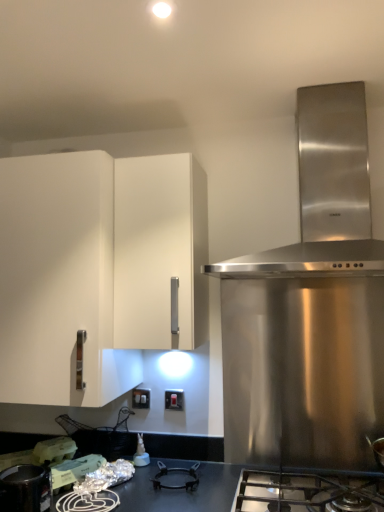
This screenshot has width=384, height=512. Find the location of `white matte cabinet at left`. white matte cabinet at left is located at coordinates (59, 281).

What do you see at coordinates (59, 281) in the screenshot? I see `white matte cabinet at left` at bounding box center [59, 281].

Locate an element on the screen. white plastic electric outlet at lower center, which ranks as the 1th electric outlet in left-to-right order is located at coordinates (141, 398).

Measure the distance between point (51, 439) and camera.

A distance of 1.83 meters exists between point (51, 439) and camera.

This screenshot has width=384, height=512. What are the coordinates of `shiny metallic pot at lower left` in the screenshot? It's located at (25, 489).

In order to face shiny metallic pot at lower left, should I rotate leftwards or rightwards?

Rotate left and turn 22.099 degrees.

Locate an element on the screen. This screenshot has height=512, width=384. stainless steel range hood at upper right is located at coordinates (325, 189).

Which of these two, stainless steel range hood at upper right or white plastic switch at lower center, the 1th electric outlet when ordered from right to left, is smaller?

white plastic switch at lower center, the 1th electric outlet when ordered from right to left.

Which object is positioned more to the right, stainless steel range hood at upper right or white plastic switch at lower center, the 1th electric outlet when ordered from right to left?

stainless steel range hood at upper right is more to the right.

How different are the orientations of stainless steel range hood at upper right and white plastic switch at lower center, the 1th electric outlet when ordered from right to left, in degrees?

There is a 0.278-degree angle between the facing directions of stainless steel range hood at upper right and white plastic switch at lower center, the 1th electric outlet when ordered from right to left.

From a real-world perspective, is stainless steel range hood at upper right above or below white plastic switch at lower center, the 1th electric outlet when ordered from right to left?

In terms of real-world spatial position, stainless steel range hood at upper right is above white plastic switch at lower center, the 1th electric outlet when ordered from right to left.

What's the angular difference between white matte plastic container at lower left and stainless steel range hood at upper right's facing directions?

They differ by 44.7 degrees in their facing directions.

Is point (53, 455) closer to camera compared to point (322, 179)?

That is False.

Is white matte plastic container at lower left not inside stainless steel range hood at upper right?

Yes, white matte plastic container at lower left is outside of stainless steel range hood at upper right.

Considering the sizes of objects stainless steel gas stove at lower center and white plastic switch at lower center, the 1th electric outlet when ordered from right to left, in the image provided, who is bigger, stainless steel gas stove at lower center or white plastic switch at lower center, the 1th electric outlet when ordered from right to left,?

Bigger between the two is stainless steel gas stove at lower center.

Between stainless steel gas stove at lower center and white plastic switch at lower center, the second electric outlet in the left-to-right sequence, which one is positioned behind?

Positioned behind is white plastic switch at lower center, the second electric outlet in the left-to-right sequence.

Is stainless steel gas stove at lower center spatially inside white plastic switch at lower center, the 1th electric outlet when ordered from right to left, or outside of it?

stainless steel gas stove at lower center lies outside white plastic switch at lower center, the 1th electric outlet when ordered from right to left.

From a real-world perspective, does stainless steel gas stove at lower center sit lower than white plastic switch at lower center, the second electric outlet in the left-to-right sequence?

Yes, from a real-world perspective, stainless steel gas stove at lower center is beneath white plastic switch at lower center, the second electric outlet in the left-to-right sequence.

From a real-world perspective, who is located lower, white plastic electric outlet at lower center, the 2th electric outlet from the right, or stainless steel gas stove at lower center?

In real-world perspective, stainless steel gas stove at lower center is lower.

Could you measure the distance between white plastic electric outlet at lower center, the 2th electric outlet from the right, and stainless steel gas stove at lower center?

29.00 inches.

Between point (137, 400) and point (383, 490), which one is positioned behind?

The point (137, 400) is farther.

Between white plastic electric outlet at lower center, the 2th electric outlet from the right, and stainless steel gas stove at lower center, which one appears on the right side from the viewer's perspective?

From the viewer's perspective, stainless steel gas stove at lower center appears more on the right side.

From a real-world perspective, between stainless steel gas stove at lower center and white plastic electric outlet at lower center, which ranks as the 1th electric outlet in left-to-right order, who is vertically higher?

white plastic electric outlet at lower center, which ranks as the 1th electric outlet in left-to-right order.

Is stainless steel gas stove at lower center in front of or behind white plastic electric outlet at lower center, which ranks as the 1th electric outlet in left-to-right order, in the image?

stainless steel gas stove at lower center is in front of white plastic electric outlet at lower center, which ranks as the 1th electric outlet in left-to-right order.

Is there a large distance between stainless steel gas stove at lower center and white plastic electric outlet at lower center, which ranks as the 1th electric outlet in left-to-right order?

No, stainless steel gas stove at lower center is not far from white plastic electric outlet at lower center, which ranks as the 1th electric outlet in left-to-right order.

Can you confirm if stainless steel gas stove at lower center is wider than white plastic electric outlet at lower center, which ranks as the 1th electric outlet in left-to-right order?

Indeed, stainless steel gas stove at lower center has a greater width compared to white plastic electric outlet at lower center, which ranks as the 1th electric outlet in left-to-right order.

Can shiny metallic pot at lower left be found inside white plastic electric outlet at lower center, which ranks as the 1th electric outlet in left-to-right order?

That's incorrect, shiny metallic pot at lower left is not inside white plastic electric outlet at lower center, which ranks as the 1th electric outlet in left-to-right order.

From the image's perspective, which one is positioned higher, white plastic electric outlet at lower center, which ranks as the 1th electric outlet in left-to-right order, or shiny metallic pot at lower left?

white plastic electric outlet at lower center, which ranks as the 1th electric outlet in left-to-right order.

From the picture: Is white plastic electric outlet at lower center, the 2th electric outlet from the right, in contact with shiny metallic pot at lower left?

No, white plastic electric outlet at lower center, the 2th electric outlet from the right, is not in contact with shiny metallic pot at lower left.

Is point (146, 401) closer to viewer compared to point (16, 493)?

No, (146, 401) is further to viewer.

Considering their positions, is white matte plastic container at lower left located in front of or behind shiny metallic pot at lower left?

white matte plastic container at lower left is positioned farther from the viewer than shiny metallic pot at lower left.

Where is `appliance above the shiny metallic pot at lower left (from a real-world perspective)`? Image resolution: width=384 pixels, height=512 pixels. appliance above the shiny metallic pot at lower left (from a real-world perspective) is located at coordinates (54, 450).

Can you confirm if white matte plastic container at lower left is shorter than shiny metallic pot at lower left?

Yes, white matte plastic container at lower left is shorter than shiny metallic pot at lower left.

Is white matte plastic container at lower left positioned far away from shiny metallic pot at lower left?

No, white matte plastic container at lower left is not far from shiny metallic pot at lower left.

Where is `home appliance above the white plastic switch at lower center, the 1th electric outlet when ordered from right to left (from the image's perspective)`? This screenshot has width=384, height=512. home appliance above the white plastic switch at lower center, the 1th electric outlet when ordered from right to left (from the image's perspective) is located at coordinates (325, 189).

The image size is (384, 512). In order to click on appliance below the stainless steel range hood at upper right (from a real-world perspective) in this screenshot , I will do `click(54, 450)`.

Considering their positions, is stainless steel range hood at upper right positioned further to white matte plastic container at lower left than white plastic electric outlet at lower center, which ranks as the 1th electric outlet in left-to-right order?

Based on the image, stainless steel range hood at upper right appears to be further to white matte plastic container at lower left.

From the image, which object appears to be farther from shiny metallic pot at lower left, white plastic electric outlet at lower center, the 2th electric outlet from the right, or stainless steel gas stove at lower center?

stainless steel gas stove at lower center is positioned further to the anchor shiny metallic pot at lower left.

Based on their spatial positions, is white plastic electric outlet at lower center, which ranks as the 1th electric outlet in left-to-right order, or white matte plastic container at lower left further from white matte cabinet at left?

white plastic electric outlet at lower center, which ranks as the 1th electric outlet in left-to-right order, is further to white matte cabinet at left.

Based on their spatial positions, is white plastic switch at lower center, the second electric outlet in the left-to-right sequence, or stainless steel range hood at upper right closer to stainless steel gas stove at lower center?

white plastic switch at lower center, the second electric outlet in the left-to-right sequence, is closer to stainless steel gas stove at lower center.

Looking at the image, which one is located closer to white plastic switch at lower center, the second electric outlet in the left-to-right sequence, white matte cabinet at left or white matte plastic container at lower left?

white matte plastic container at lower left.

Based on their spatial positions, is shiny metallic pot at lower left or white matte cabinet at left closer to white plastic switch at lower center, the 1th electric outlet when ordered from right to left?

shiny metallic pot at lower left lies closer to white plastic switch at lower center, the 1th electric outlet when ordered from right to left, than the other object.

Based on their spatial positions, is stainless steel range hood at upper right or white plastic electric outlet at lower center, the 2th electric outlet from the right, closer to stainless steel gas stove at lower center?

Among the two, white plastic electric outlet at lower center, the 2th electric outlet from the right, is located nearer to stainless steel gas stove at lower center.

Based on their spatial positions, is white plastic switch at lower center, the 1th electric outlet when ordered from right to left, or stainless steel range hood at upper right further from white plastic electric outlet at lower center, the 2th electric outlet from the right?

Among the two, stainless steel range hood at upper right is located further to white plastic electric outlet at lower center, the 2th electric outlet from the right.

Locate an element on the screen. This screenshot has width=384, height=512. appliance between shiny metallic pot at lower left and stainless steel gas stove at lower center in the horizontal direction is located at coordinates (54, 450).

Where is `electric outlet between white matte cabinet at left and white plastic electric outlet at lower center, the 2th electric outlet from the right, from top to bottom`? Image resolution: width=384 pixels, height=512 pixels. electric outlet between white matte cabinet at left and white plastic electric outlet at lower center, the 2th electric outlet from the right, from top to bottom is located at coordinates (174, 399).

This screenshot has height=512, width=384. Identify the location of cabinetry positioned between shiny metallic pot at lower left and white plastic electric outlet at lower center, the 2th electric outlet from the right, from near to far. 59,281.

This screenshot has width=384, height=512. Identify the location of cabinetry between stainless steel range hood at upper right and shiny metallic pot at lower left from top to bottom. (59, 281).